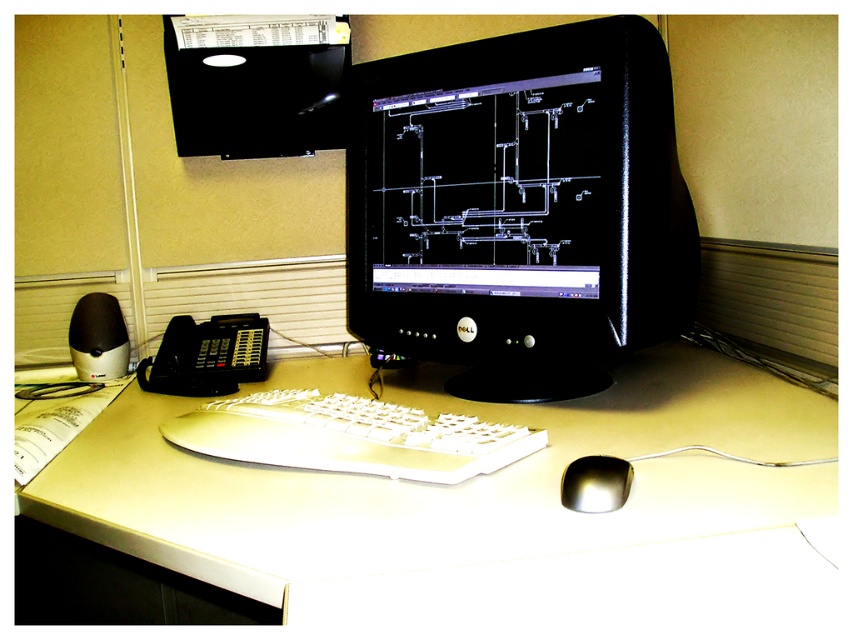
Question: Can you confirm if white plastic computer desk at center is positioned above white plastic keyboard at center?

Choices:
 (A) no
 (B) yes

Answer: (A)

Question: Does white plastic keyboard at center have a larger size compared to black plastic phone at lower left?

Choices:
 (A) no
 (B) yes

Answer: (A)

Question: Is black glossy monitor at center further to the viewer compared to black matte speaker at left?

Choices:
 (A) no
 (B) yes

Answer: (A)

Question: Which of the following is the farthest from the observer?

Choices:
 (A) (212, 364)
 (B) (473, 304)
 (C) (111, 364)
 (D) (573, 557)

Answer: (C)

Question: Which object is positioned closest to the black matte speaker at left?

Choices:
 (A) satin silver mouse at lower right
 (B) white plastic keyboard at center
 (C) black plastic phone at lower left

Answer: (C)

Question: Which point appears farthest from the camera in this image?

Choices:
 (A) (560, 496)
 (B) (761, 490)

Answer: (A)